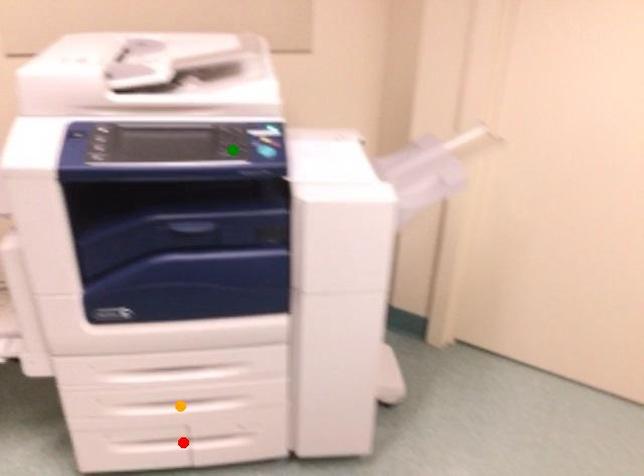
Based on the photo, order these from nearest to farthest:
orange point
green point
red point

green point
orange point
red point